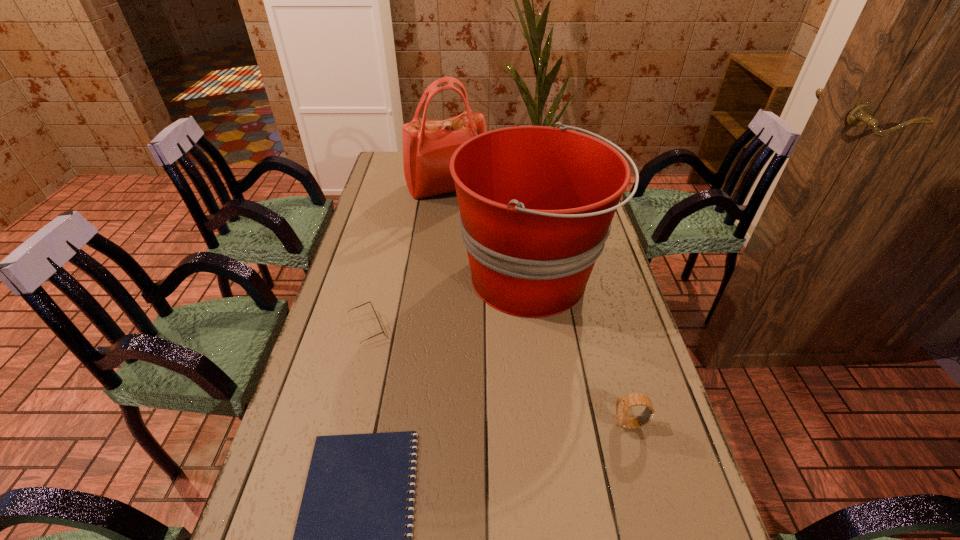
The width and height of the screenshot is (960, 540). Identify the location of free point between the bucket and the second shortest object. (449, 303).

What are the coordinates of `vacant point located between the third shortest object and the fourth tallest object` in the screenshot? It's located at tap(498, 376).

At what (x,y) coordinates should I click in order to perform the action: click on object that ranks as the second closest to the shortest object. Please return your answer as a coordinate pair (x, y). The width and height of the screenshot is (960, 540). Looking at the image, I should click on (536, 203).

You are a GUI agent. You are given a task and a screenshot of the screen. Output one action in this format:
    pyautogui.click(x=<x>, y=<y>)
    Task: Click on the closest object to the bucket
    
    Given the screenshot: What is the action you would take?
    pyautogui.click(x=428, y=145)

At what (x,y) coordinates should I click in order to perform the action: click on blank space that satisfies the following two spatial constraints: 1. on the front-facing side of the farthest object; 2. with the lenses facing outward on the fourth tallest object. Please return your answer as a coordinate pair (x, y). Looking at the image, I should click on (435, 328).

Where is `free space that satisfies the following two spatial constraints: 1. on the front-facing side of the bucket; 2. on the right side of the handbag`? The image size is (960, 540). free space that satisfies the following two spatial constraints: 1. on the front-facing side of the bucket; 2. on the right side of the handbag is located at coordinates (440, 278).

Find the location of a particular element. Image resolution: width=960 pixels, height=540 pixels. free spot that satisfies the following two spatial constraints: 1. on the front-facing side of the bucket; 2. on the left side of the farthest object is located at coordinates (440, 278).